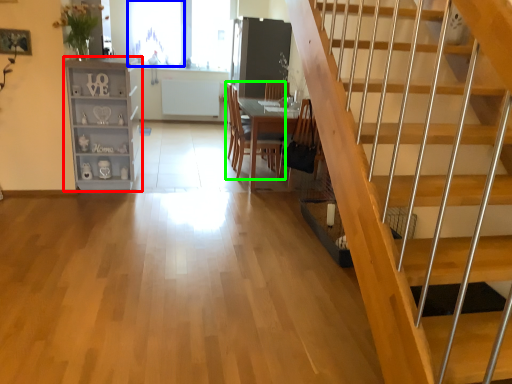
Question: Estimate the real-world distances between objects in this image. Which object is farther from shelf (highlighted by a red box), window (highlighted by a blue box) or chair (highlighted by a green box)?

Choices:
 (A) window
 (B) chair

Answer: (A)